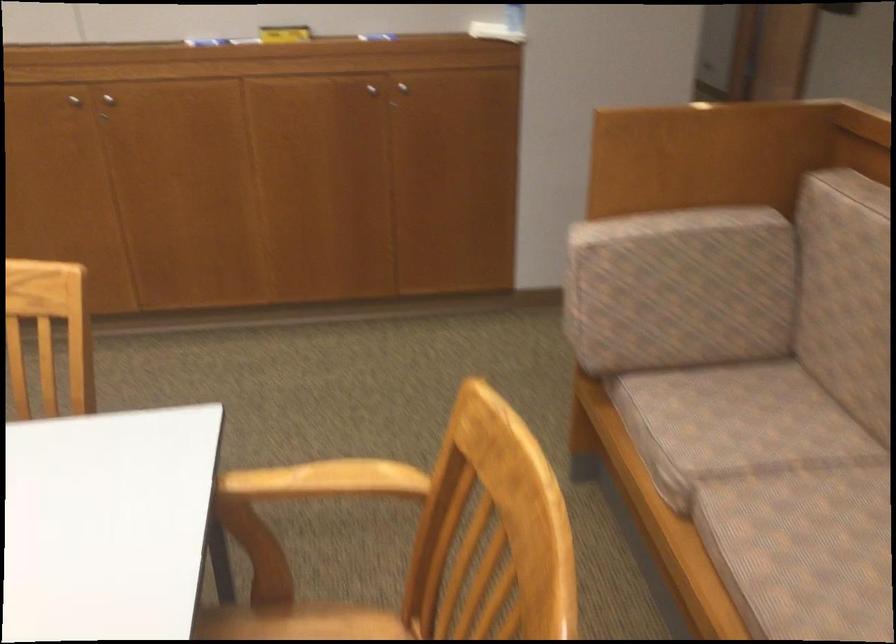
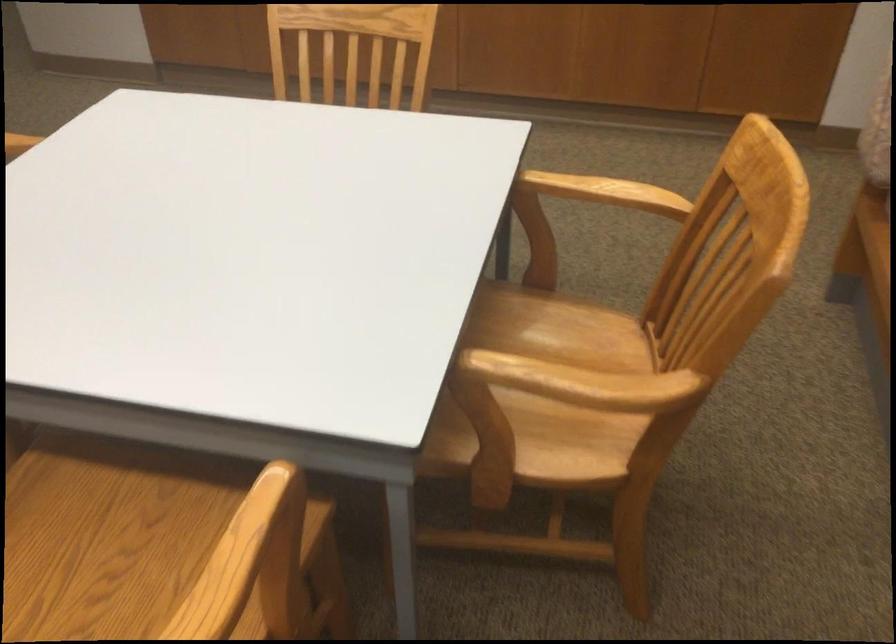
Find the pixel in the second image that matches point 330,482 in the first image.

(605, 192)